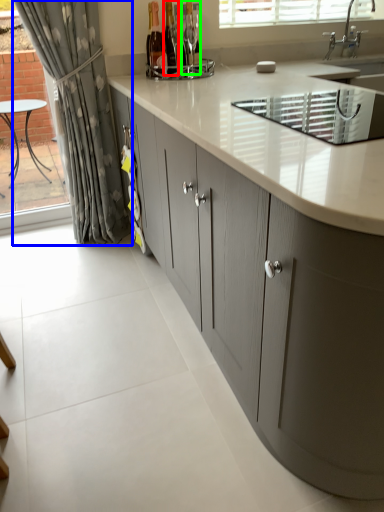
Question: Which object is positioned farthest from bottle (highlighted by a red box)? Select from curtain (highlighted by a blue box) and bottle (highlighted by a green box).

Choices:
 (A) curtain
 (B) bottle

Answer: (A)